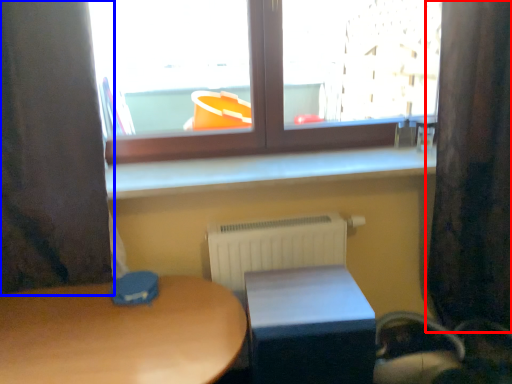
Question: Which point is closer to the camera, curtain (highlighted by a red box) or curtain (highlighted by a blue box)?

Choices:
 (A) curtain
 (B) curtain

Answer: (B)